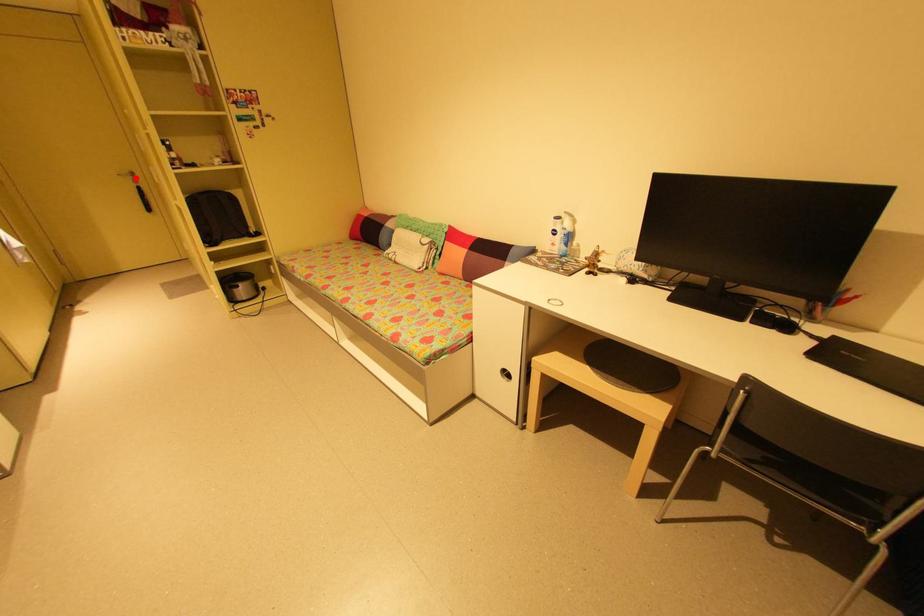
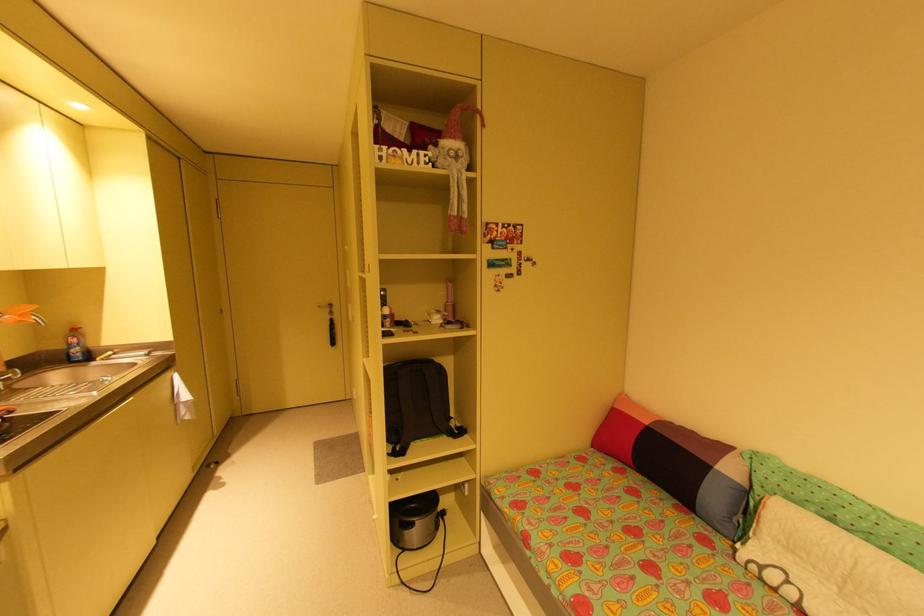
Question: I am providing you with two images of the same scene from different viewpoints. A red point is marked on the first image. Is the red point's position out of view in image 2?

Choices:
 (A) Yes
 (B) No

Answer: (B)